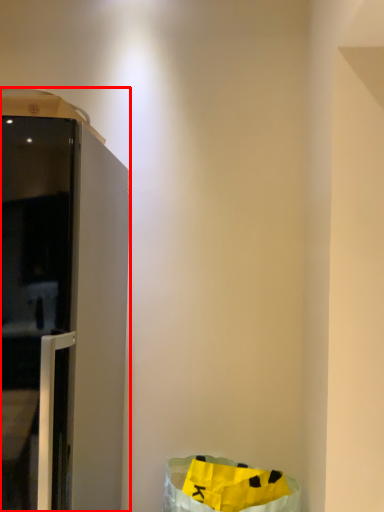
Question: In this image, where is furniture (annotated by the red box) located relative to recycling bin?

Choices:
 (A) right
 (B) left

Answer: (B)